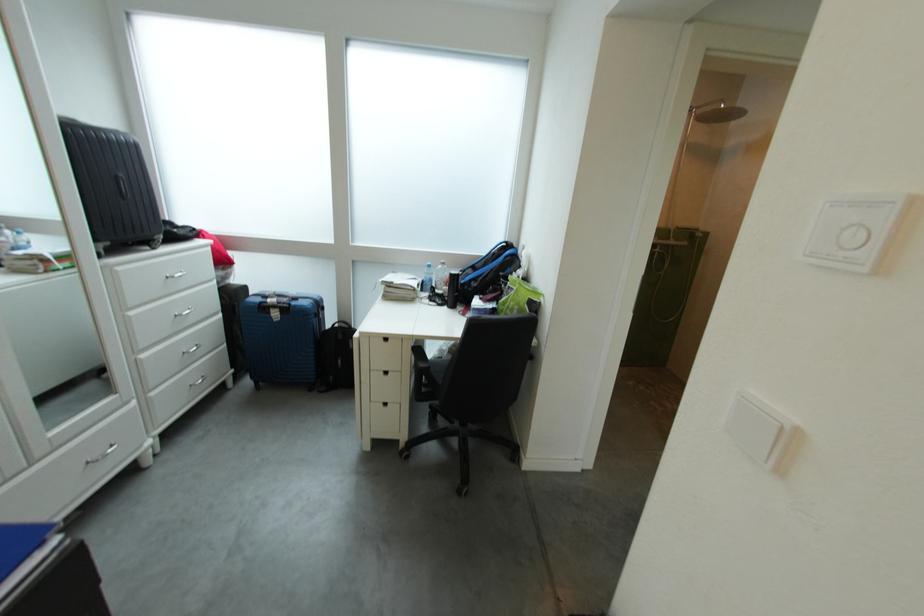
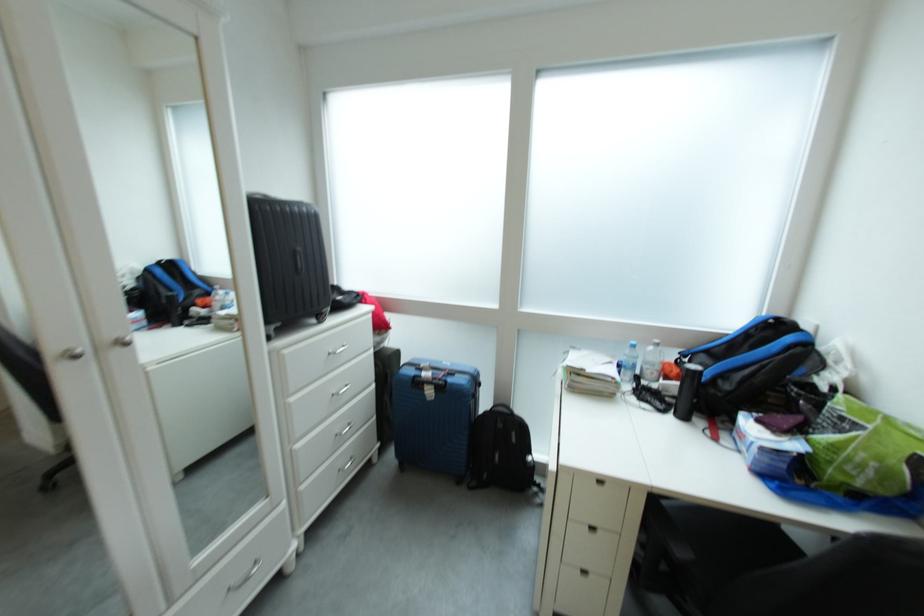
Locate, in the second image, the point that corresponds to point (420, 291) in the first image.

(622, 383)